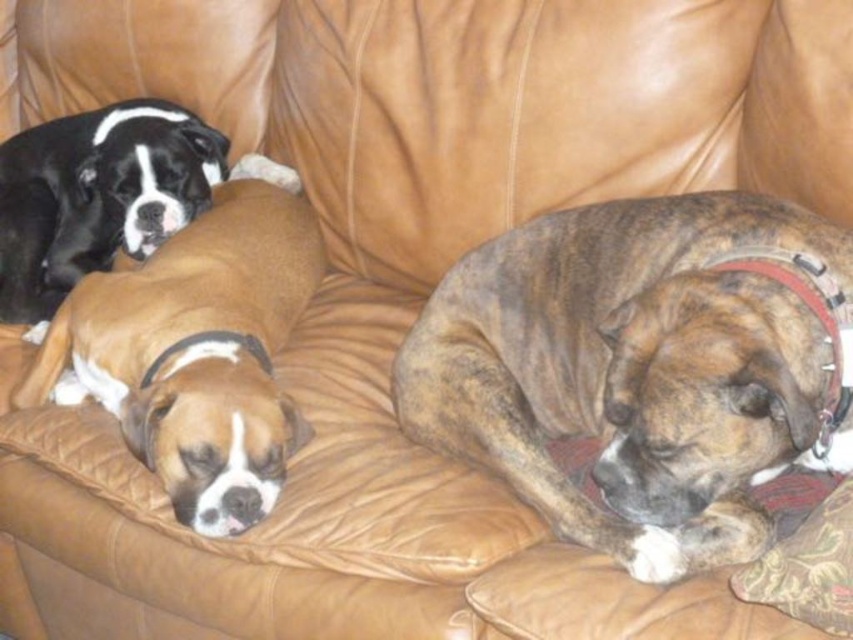
Question: Can you confirm if brown brindle dog at center is positioned above brown leather dog at center?

Choices:
 (A) no
 (B) yes

Answer: (A)

Question: Which of these objects is positioned closest to the brown brindle dog at center?

Choices:
 (A) black glossy dog at upper left
 (B) brown leather dog at center

Answer: (B)

Question: Does brown brindle dog at center appear over brown leather dog at center?

Choices:
 (A) yes
 (B) no

Answer: (B)

Question: Which point appears farthest from the camera in this image?

Choices:
 (A) (840, 348)
 (B) (4, 184)
 (C) (166, 248)

Answer: (B)

Question: Is brown brindle dog at center smaller than brown leather dog at center?

Choices:
 (A) no
 (B) yes

Answer: (B)

Question: Estimate the real-world distances between objects in this image. Which object is farther from the brown brindle dog at center?

Choices:
 (A) black glossy dog at upper left
 (B) brown leather dog at center

Answer: (A)